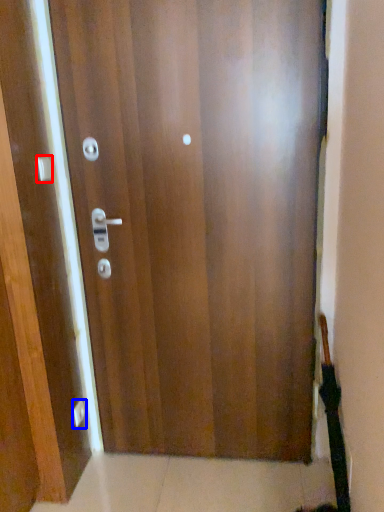
Question: Which point is closer to the camera, handle (highlighted by a red box) or knob (highlighted by a blue box)?

Choices:
 (A) handle
 (B) knob

Answer: (A)